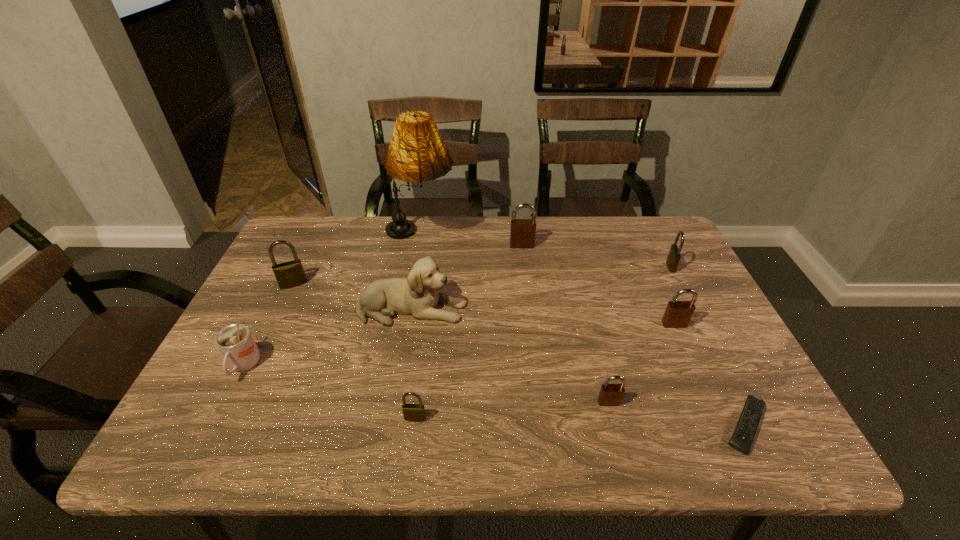
This screenshot has width=960, height=540. I want to click on lampshade, so click(x=417, y=153).

You are a GUI agent. You are given a task and a screenshot of the screen. Output one action in this format:
    pyautogui.click(x=<x>, y=<y>)
    Task: Click on the puppy
    
    Given the screenshot: What is the action you would take?
    pyautogui.click(x=418, y=295)

The image size is (960, 540). Identify the location of the second farthest brass padlock. (290, 274).

Where is `the seventh nearest object`? This screenshot has height=540, width=960. the seventh nearest object is located at coordinates (290, 274).

Locate an element on the screen. Image resolution: width=960 pixels, height=540 pixels. the sixth object from left to right is located at coordinates (522, 231).

Find the location of a particular element. the farthest padlock is located at coordinates 522,231.

This screenshot has height=540, width=960. I want to click on the second biggest brown padlock, so 678,314.

Image resolution: width=960 pixels, height=540 pixels. I want to click on the second farthest brown padlock, so click(x=678, y=314).

Where is `the eighth nearest object`? Image resolution: width=960 pixels, height=540 pixels. the eighth nearest object is located at coordinates (674, 255).

Locate an element on the screen. This screenshot has height=540, width=960. the second biggest brass padlock is located at coordinates (674, 255).